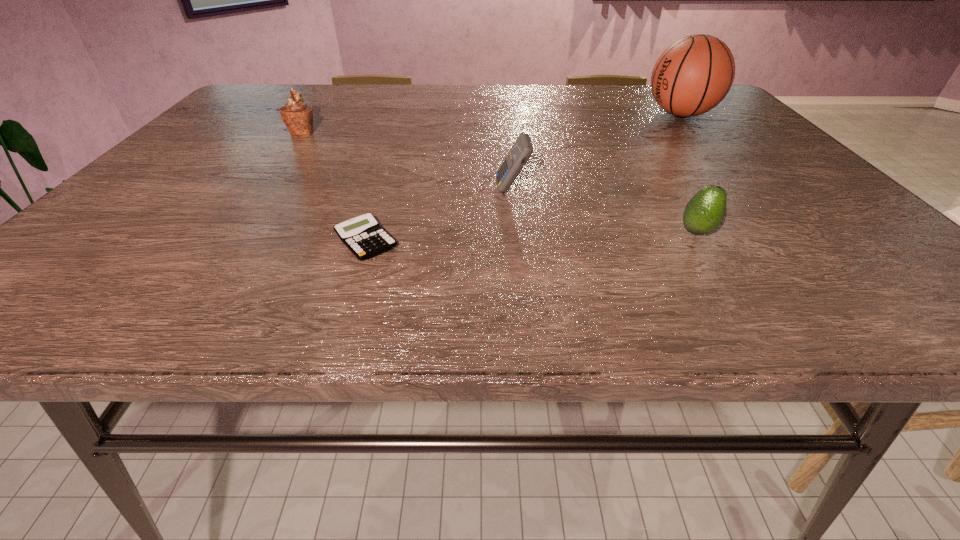
Identify the location of object present at the far right corner. (693, 75).

The width and height of the screenshot is (960, 540). I want to click on free space at the far edge of the desktop, so click(x=416, y=85).

At what (x,y) coordinates should I click in order to perform the action: click on vacant space at the near edge of the desktop. Please return your answer as a coordinate pair (x, y). The height and width of the screenshot is (540, 960). Looking at the image, I should click on (697, 300).

Locate an element on the screen. Image resolution: width=960 pixels, height=540 pixels. free space at the left edge of the desktop is located at coordinates 201,133.

Identify the location of vacant space at the right edge of the desktop. (744, 171).

In the image, there is a desktop. Where is `vacant space at the near left corner`? vacant space at the near left corner is located at coordinates (47, 304).

Find the location of a particular element. The width and height of the screenshot is (960, 540). vacant space at the far right corner is located at coordinates (728, 110).

At what (x,y) coordinates should I click in order to perform the action: click on free area in between the muffin and the right calculator. Please return your answer as a coordinate pair (x, y). Looking at the image, I should click on (407, 161).

At what (x,y) coordinates should I click in order to perform the action: click on free space between the second shortest object and the nearer calculator. Please return your answer as a coordinate pair (x, y). This screenshot has height=540, width=960. Looking at the image, I should click on (532, 237).

Identify the location of empty space that is in between the muffin and the basketball. (492, 124).